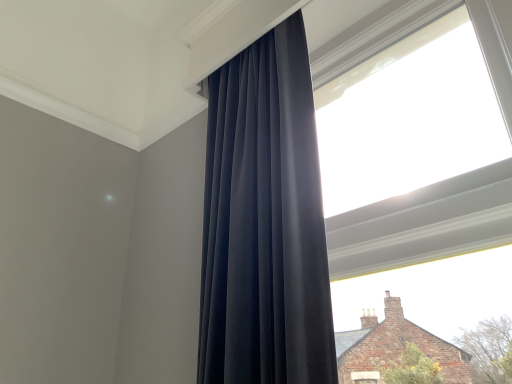
Identify the location of transparent glass window at upper center. This screenshot has height=384, width=512. (424, 224).

What do you see at coordinates (424, 224) in the screenshot? Image resolution: width=512 pixels, height=384 pixels. I see `transparent glass window at upper center` at bounding box center [424, 224].

In order to face transparent glass window at upper center, should I rotate leftwards or rightwards?

To face it directly, rotate right by 20.201 degrees.

In the scene shown: What is the approximate height of transparent glass window at upper center?

Result: transparent glass window at upper center is 3.33 feet tall.

What do you see at coordinates (264, 222) in the screenshot? I see `matte black curtain at center` at bounding box center [264, 222].

Find the location of a particular element. matte black curtain at center is located at coordinates (264, 222).

Locate an element on the screen. This screenshot has height=384, width=512. transparent glass window at upper center is located at coordinates (424, 224).

Considering the positions of objects transparent glass window at upper center and matte black curtain at center in the image provided, who is more to the left, transparent glass window at upper center or matte black curtain at center?

From the viewer's perspective, matte black curtain at center appears more on the left side.

Which object is further away from the camera taking this photo, transparent glass window at upper center or matte black curtain at center?

matte black curtain at center is behind.

Which is behind, point (506, 235) or point (224, 137)?

Positioned behind is point (224, 137).

From the image's perspective, between transparent glass window at upper center and matte black curtain at center, which one is located above?

transparent glass window at upper center, from the image's perspective.

Consider the image. From a real-world perspective, is transparent glass window at upper center located higher than matte black curtain at center?

Yes, from a real-world perspective, transparent glass window at upper center is over matte black curtain at center

Which of these two, transparent glass window at upper center or matte black curtain at center, is thinner?

transparent glass window at upper center.

Considering the relative sizes of transparent glass window at upper center and matte black curtain at center in the image provided, is transparent glass window at upper center shorter than matte black curtain at center?

In fact, transparent glass window at upper center may be taller than matte black curtain at center.

Which of these two, transparent glass window at upper center or matte black curtain at center, is bigger?

With larger size is matte black curtain at center.

Is transparent glass window at upper center outside of matte black curtain at center?

Yes.

Would you consider transparent glass window at upper center to be distant from matte black curtain at center?

No, transparent glass window at upper center is in close proximity to matte black curtain at center.

Is transparent glass window at upper center oriented towards matte black curtain at center?

Yes, transparent glass window at upper center is oriented towards matte black curtain at center.

Where is `window to the right of matte black curtain at center`? Image resolution: width=512 pixels, height=384 pixels. window to the right of matte black curtain at center is located at coordinates (424, 224).

Can you confirm if matte black curtain at center is positioned to the left of transparent glass window at upper center?

Indeed, matte black curtain at center is positioned on the left side of transparent glass window at upper center.

Is matte black curtain at center in front of or behind transparent glass window at upper center in the image?

matte black curtain at center is behind transparent glass window at upper center.

Considering the positions of point (262, 275) and point (484, 36), is point (262, 275) closer or farther from the camera than point (484, 36)?

Point (262, 275) appears to be closer to the viewer than point (484, 36).

From the image's perspective, who appears lower, matte black curtain at center or transparent glass window at upper center?

matte black curtain at center appears lower in the image.

From a real-world perspective, is matte black curtain at center below transparent glass window at upper center?

Yes.

Which of these two, matte black curtain at center or transparent glass window at upper center, is thinner?

transparent glass window at upper center is thinner.

Who is shorter, matte black curtain at center or transparent glass window at upper center?

With less height is matte black curtain at center.

Considering the relative sizes of matte black curtain at center and transparent glass window at upper center in the image provided, is matte black curtain at center smaller than transparent glass window at upper center?

No, matte black curtain at center is not smaller than transparent glass window at upper center.

Is matte black curtain at center not within transparent glass window at upper center?

Yes, matte black curtain at center is located beyond the bounds of transparent glass window at upper center.

Is matte black curtain at center placed right next to transparent glass window at upper center?

No, matte black curtain at center is not beside transparent glass window at upper center.

Is matte black curtain at center turned away from transparent glass window at upper center?

matte black curtain at center is not turned away from transparent glass window at upper center.

How different are the orientations of matte black curtain at center and transparent glass window at upper center in degrees?

The angular difference between matte black curtain at center and transparent glass window at upper center is 2.27 degrees.

The width and height of the screenshot is (512, 384). What are the coordinates of `curtain below the transparent glass window at upper center (from a real-world perspective)` in the screenshot? It's located at (264, 222).

At what (x,y) coordinates should I click in order to perform the action: click on curtain behind the transparent glass window at upper center. Please return your answer as a coordinate pair (x, y). Looking at the image, I should click on (264, 222).

Find the location of a particular element. The width and height of the screenshot is (512, 384). window that appears above the matte black curtain at center (from a real-world perspective) is located at coordinates (424, 224).